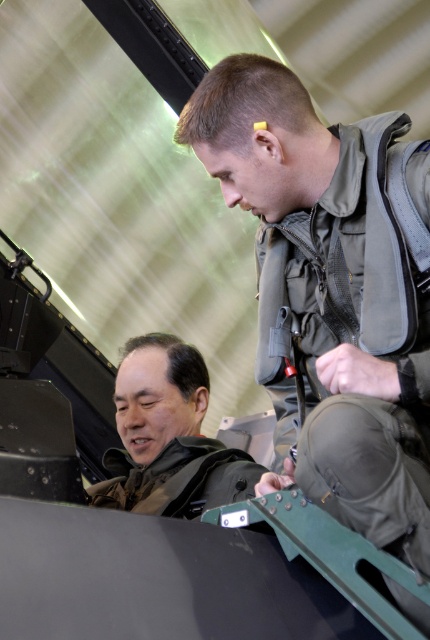
Question: Which object is closer to the camera taking this photo?

Choices:
 (A) brown leather jacket at lower left
 (B) matte green uniform at center

Answer: (B)

Question: Is matte green uniform at center below brown leather jacket at lower left?

Choices:
 (A) yes
 (B) no

Answer: (B)

Question: Is matte green uniform at center further to the viewer compared to brown leather jacket at lower left?

Choices:
 (A) no
 (B) yes

Answer: (A)

Question: Is matte green uniform at center thinner than brown leather jacket at lower left?

Choices:
 (A) yes
 (B) no

Answer: (A)

Question: Which object is farther from the camera taking this photo?

Choices:
 (A) brown leather jacket at lower left
 (B) matte green uniform at center

Answer: (A)